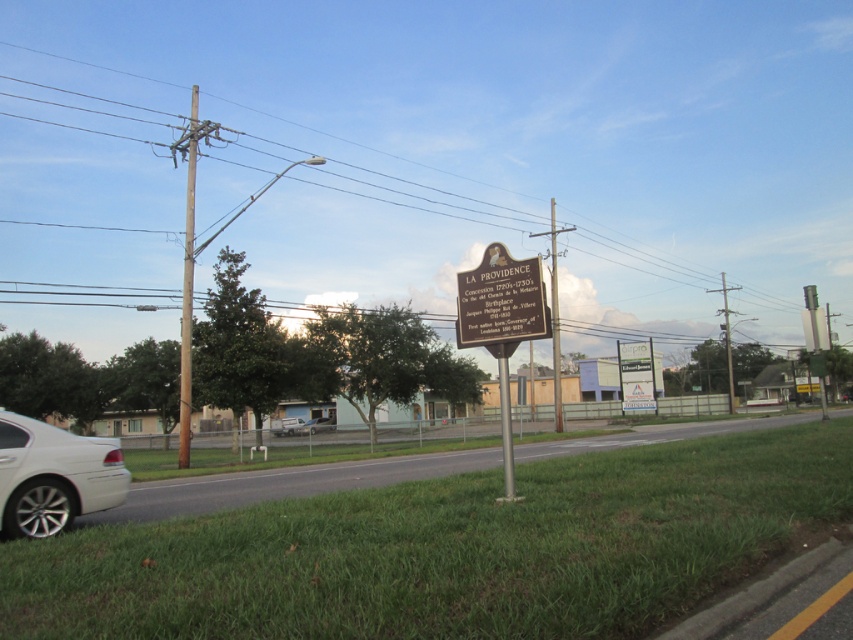
From the picture: You are standing at the center of the road in the image. Which direction should you walk to reach the white plastic sign at center?

The white plastic sign at center is located at point coordinates 0.588 on the x axis and 0.747 on the y axis. Since you are at the center of the road, which is likely at coordinates around (426, 320), you should walk northeast to reach the white plastic sign at center.

You are a delivery driver who needs to park your truck between the white plastic sign at center and the silver metallic sedan at center. The truck is 40 feet long. Is there enough space between the two objects to park the truck?

The distance between the white plastic sign at center and the silver metallic sedan at center is 81.58 feet. Since the truck is 40 feet long, there is sufficient space to park the truck between them as 81.58 feet is greater than 40 feet.

From the picture: You are a painter who needs to paint both the matte metal sign at center and the metallic pole at center. If you have limited paint, which object should you prioritize to ensure you have enough paint for both?

The matte metal sign at center occupies less space than the metallic pole at center, so you should prioritize painting the metallic pole at center first to ensure there is enough paint left for the smaller sign.